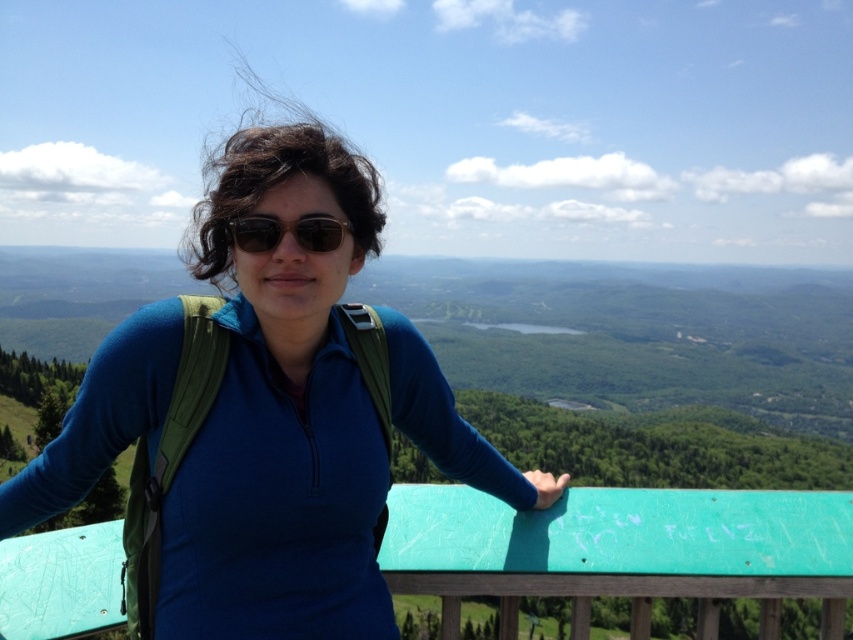
Which is in front, point (212, 512) or point (314, 252)?

Positioned in front is point (212, 512).

Describe the element at coordinates (265, 417) in the screenshot. I see `blue fabric shirt at center` at that location.

The height and width of the screenshot is (640, 853). I want to click on blue fabric shirt at center, so click(265, 417).